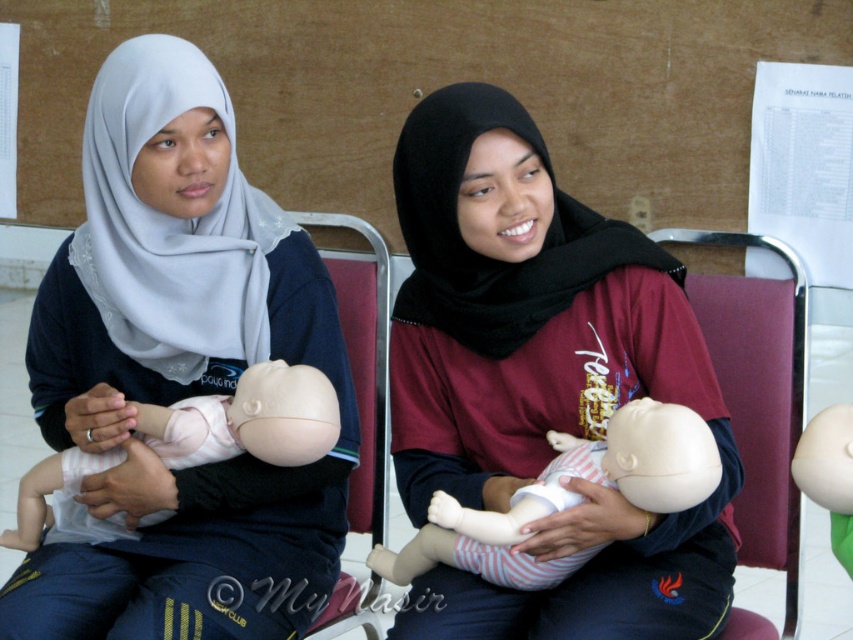
Question: Is pink matte baby doll at center below matte plastic baby doll at center?

Choices:
 (A) yes
 (B) no

Answer: (A)

Question: In this image, where is matte black baby doll at center located relative to white matte baby doll at center?

Choices:
 (A) left
 (B) right

Answer: (A)

Question: Is white matte baby doll at center positioned in front of pink matte baby doll at center?

Choices:
 (A) no
 (B) yes

Answer: (B)

Question: Which of these objects is positioned farthest from the matte white hijab at upper left?

Choices:
 (A) pink matte baby doll at center
 (B) white matte baby doll at center

Answer: (B)

Question: Estimate the real-world distances between objects in this image. Which object is closer to the matte black baby doll at center?

Choices:
 (A) matte plastic baby doll at center
 (B) white matte baby doll at center
 (C) matte white hijab at upper left
 (D) pink matte baby doll at center

Answer: (B)

Question: Which object is positioned farthest from the matte black baby doll at center?

Choices:
 (A) matte white hijab at upper left
 (B) white matte baby doll at center
 (C) matte plastic baby doll at center
 (D) pink matte baby doll at center

Answer: (C)